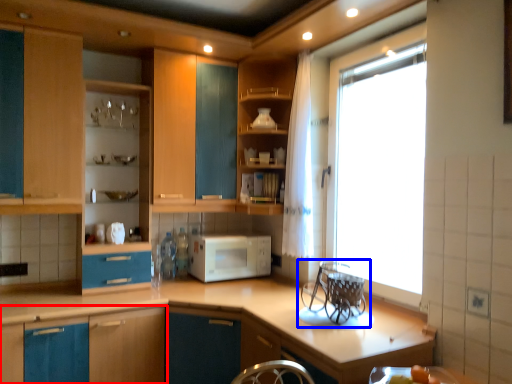
Question: Which object appears closest to the camera in this image, cabinetry (highlighted by a red box) or appliance (highlighted by a blue box)?

Choices:
 (A) cabinetry
 (B) appliance

Answer: (B)